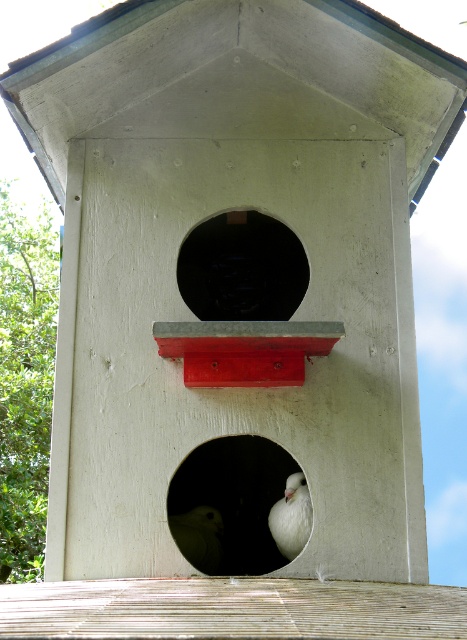
You are a bird looking for a nesting spot. You see a black matte hole at center. Where exactly is this hole located in the image?

The black matte hole at center is located at point coordinates of (241, 268).